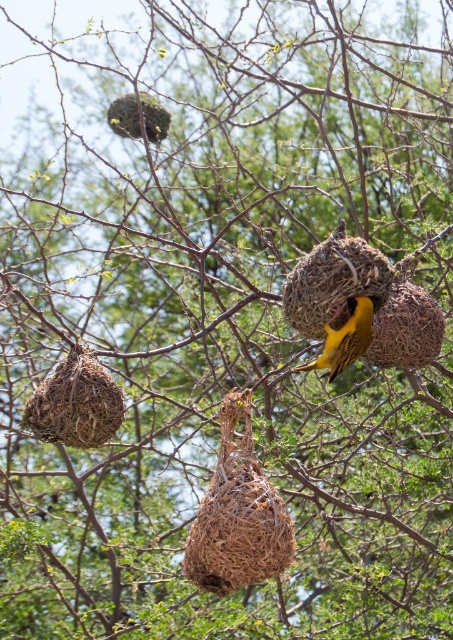
You are standing in front of the tree and notice two points marked in the image. Which point, point (245, 500) or point (312, 330), is closer to you?

Point (245, 500) is closer to the camera than point (312, 330), so it is closer to you.